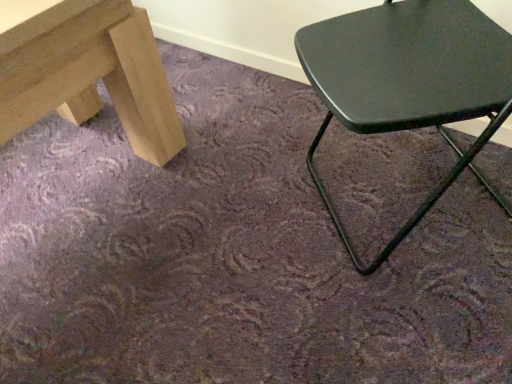
Question: Should I look upward or downward to see metallic green chair at right?

Choices:
 (A) up
 (B) down

Answer: (A)